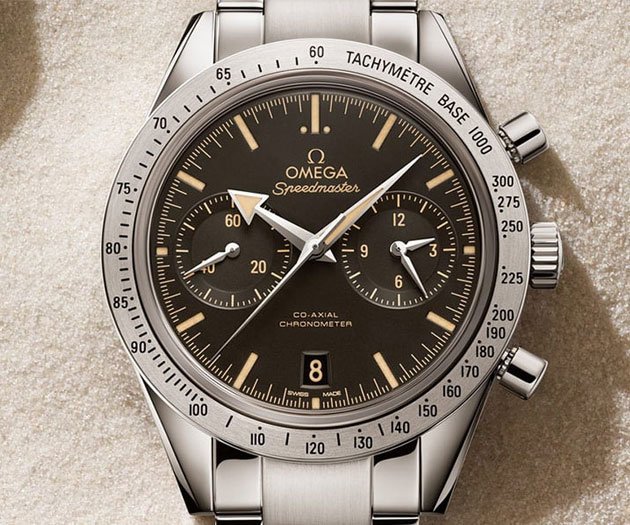
Locate an element on the screen. The image size is (630, 525). smooth knobs is located at coordinates (522, 368), (522, 132).